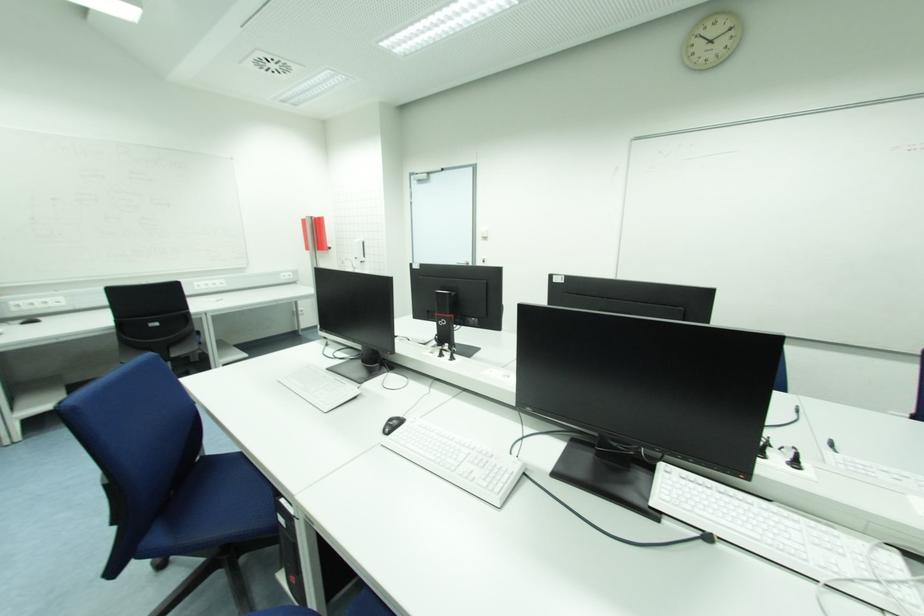
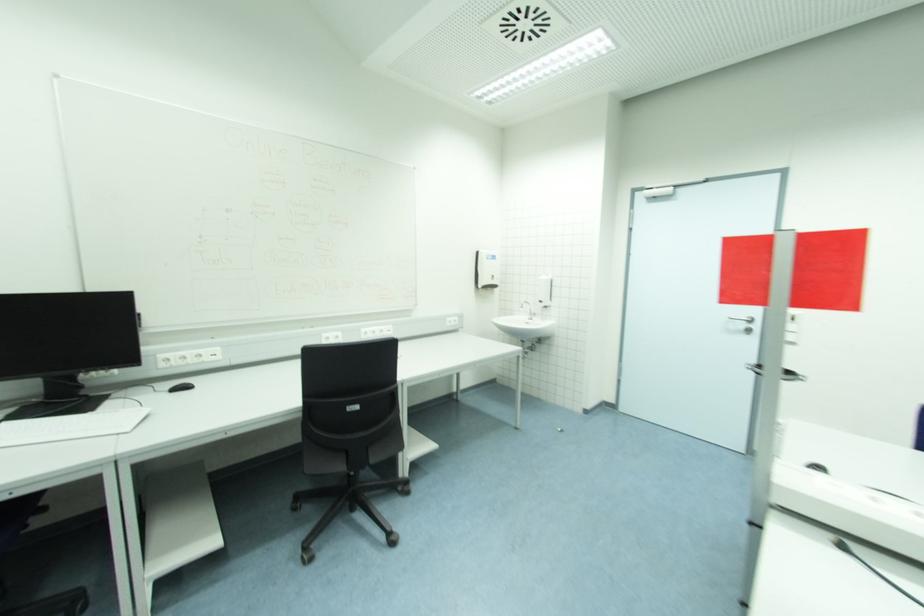
Locate, in the second image, the point that corresponds to the point at 359,260 in the first image.

(543, 302)